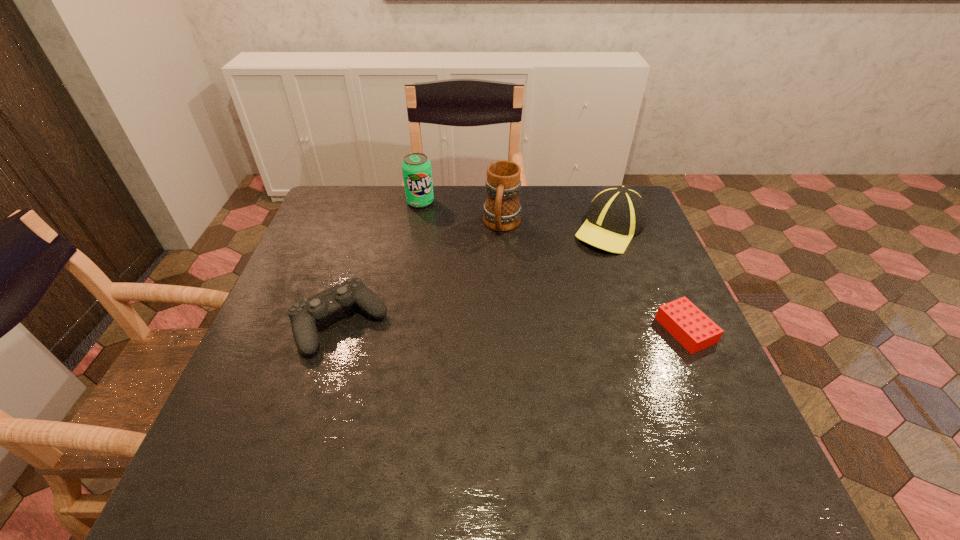
Where is `control`? This screenshot has width=960, height=540. control is located at coordinates (304, 315).

Locate an element on the screen. The height and width of the screenshot is (540, 960). the shortest object is located at coordinates (695, 331).

This screenshot has width=960, height=540. What are the coordinates of `baseball cap` in the screenshot? It's located at (616, 214).

This screenshot has width=960, height=540. In order to click on the second tallest object in this screenshot , I will do click(416, 168).

At what (x,y) coordinates should I click in order to perform the action: click on the third object from right to left. Please return your answer as a coordinate pair (x, y). Looking at the image, I should click on (502, 211).

At what (x,y) coordinates should I click in order to perform the action: click on blank area located on the back of the control. Please return your answer as a coordinate pair (x, y). This screenshot has width=960, height=540. Looking at the image, I should click on (359, 260).

At what (x,y) coordinates should I click in order to perform the action: click on vacant space located on the front of the shortest object. Please return your answer as a coordinate pair (x, y). The image size is (960, 540). Looking at the image, I should click on (725, 420).

Where is `vacant space situated with the brim of the baseball cap facing forward`? The image size is (960, 540). vacant space situated with the brim of the baseball cap facing forward is located at coordinates (560, 271).

Identify the location of free region located 0.260m with the brim of the baseball cap facing forward. The image size is (960, 540). pos(531,293).

Find the location of a particular element. This screenshot has width=960, height=540. free space located with the brim of the baseball cap facing forward is located at coordinates (568, 264).